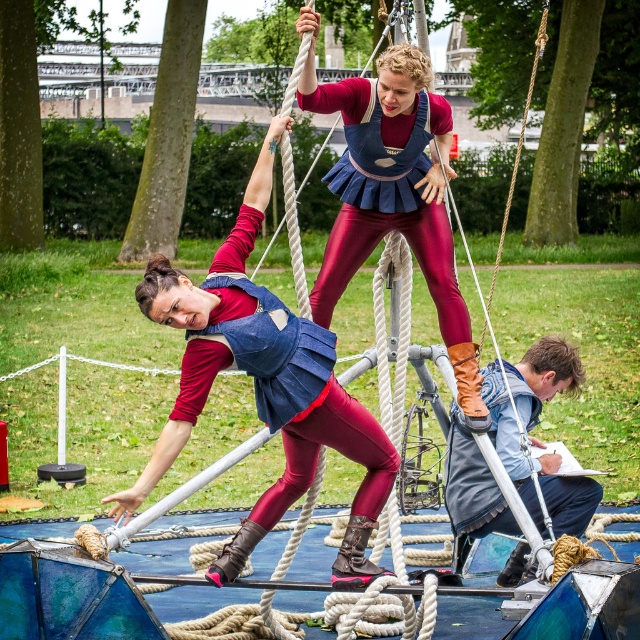
Question: Which object is closer to the camera taking this photo?

Choices:
 (A) shiny maroon leggings at center
 (B) denim jacket at lower right
 (C) denim vest at center

Answer: (C)

Question: Which object appears closest to the camera in this image?

Choices:
 (A) denim jacket at lower right
 (B) denim vest at center
 (C) shiny maroon leggings at center

Answer: (B)

Question: Does shiny maroon leggings at center lie in front of denim vest at center?

Choices:
 (A) yes
 (B) no

Answer: (B)

Question: Is denim vest at center to the left of denim jacket at lower right from the viewer's perspective?

Choices:
 (A) no
 (B) yes

Answer: (B)

Question: Among these points, which one is nearest to the camera?

Choices:
 (A) (396, 195)
 (B) (250, 541)

Answer: (B)

Question: Is shiny maroon leggings at center thinner than denim vest at center?

Choices:
 (A) yes
 (B) no

Answer: (A)